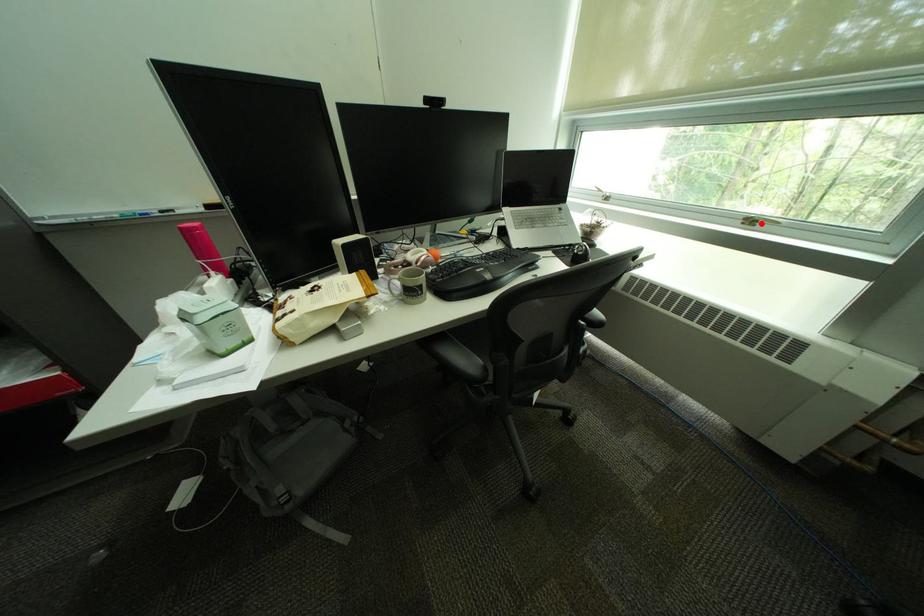
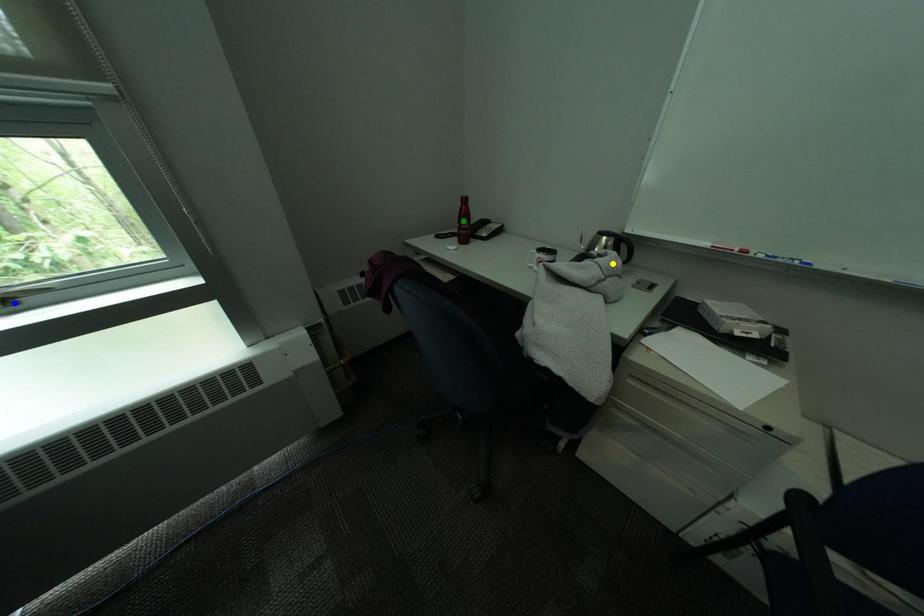
Question: I am providing you with two images of the same scene from different viewpoints. A red point is marked on the first image. You are given multiple points on the second image. In image 2, which mark is for the same physical point as the one in image 1?

Choices:
 (A) green point
 (B) blue point
 (C) yellow point

Answer: (B)